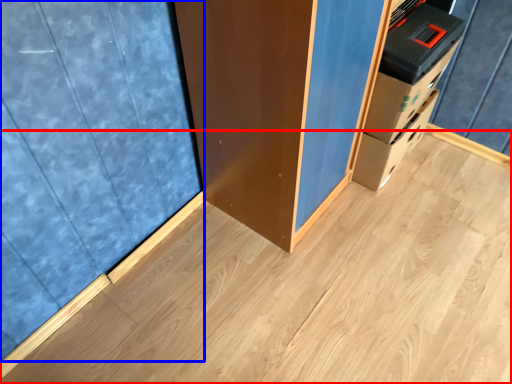
Question: Which object appears closest to the camera in this image, plywood (highlighted by a red box) or curtain (highlighted by a blue box)?

Choices:
 (A) plywood
 (B) curtain

Answer: (B)